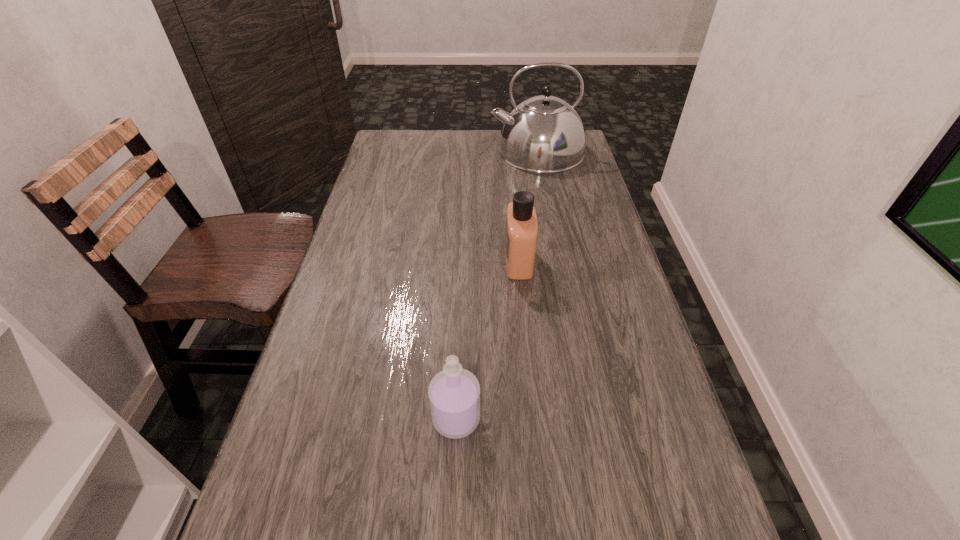
I want to click on free spot between the nearest object and the farthest object, so click(x=496, y=285).

Image resolution: width=960 pixels, height=540 pixels. In order to click on vacant area that lies between the tallest object and the left perfume in this screenshot , I will do `click(496, 285)`.

Identify the location of vacant space that's between the farther perfume and the leftmost object. The image size is (960, 540). (488, 340).

Find the location of a particular element. The width and height of the screenshot is (960, 540). free space between the farther perfume and the nearer perfume is located at coordinates 488,340.

Where is `vacant area between the tallest object and the left perfume`? vacant area between the tallest object and the left perfume is located at coordinates (496, 285).

Identify the location of object that is the second closest to the kettle. This screenshot has height=540, width=960. (454, 393).

Locate which object is the second closest to the left perfume. Please provide its 2D coordinates. Your answer should be formatted as a tuple, i.e. [(x, y)], where the tuple contains the x and y coordinates of a point satisfying the conditions above.

[(544, 134)]

Where is `vacant space that satisfies the following two spatial constraints: 1. on the front label of the second farthest object; 2. on the front side of the nearest object`? The height and width of the screenshot is (540, 960). vacant space that satisfies the following two spatial constraints: 1. on the front label of the second farthest object; 2. on the front side of the nearest object is located at coordinates (534, 418).

At what (x,y) coordinates should I click in order to perform the action: click on free spot that satisfies the following two spatial constraints: 1. on the front label of the second farthest object; 2. on the front side of the leftmost object. Please return your answer as a coordinate pair (x, y). The width and height of the screenshot is (960, 540). Looking at the image, I should click on (534, 418).